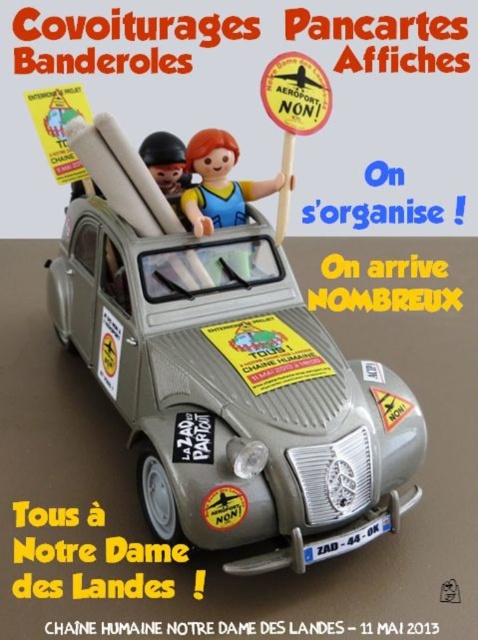
Can you confirm if matte gray car at center is taller than plastic toy figure at center?

Yes, matte gray car at center is taller than plastic toy figure at center.

This screenshot has height=640, width=478. I want to click on matte gray car at center, so click(x=234, y=390).

Does plastic toy figure at center have a lesser width compared to orange paper sign at upper center?

Incorrect, plastic toy figure at center's width is not less than orange paper sign at upper center's.

Is plastic toy figure at center below orange paper sign at upper center?

Yes.

Is point (230, 180) positioned behind point (288, 129)?

Yes, it is.

Where is `plastic toy figure at center`? This screenshot has height=640, width=478. plastic toy figure at center is located at coordinates (218, 182).

Which of these two, matte gray car at center or orange paper sign at upper center, stands taller?

matte gray car at center

This screenshot has height=640, width=478. Describe the element at coordinates (234, 390) in the screenshot. I see `matte gray car at center` at that location.

Between point (332, 365) and point (301, 60), which one is positioned behind?

Point (301, 60)

Locate an element on the screen. The width and height of the screenshot is (478, 640). matte gray car at center is located at coordinates (234, 390).